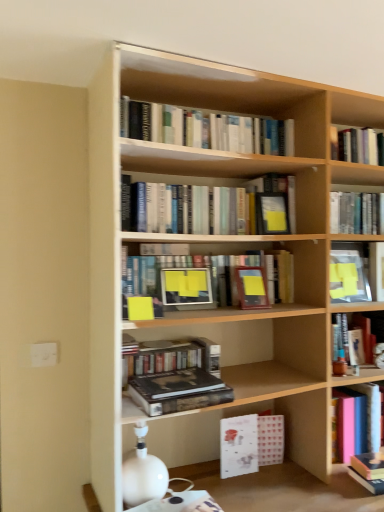
Locate an element on the screen. The width and height of the screenshot is (384, 512). blank space situated above hardcover books at upper center, placed as the 6th book when sorted from bottom to top (from a real-world perspective) is located at coordinates 222,168.